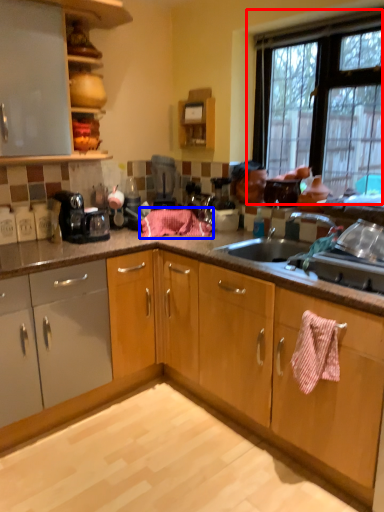
Question: Among these objects, which one is farthest to the camera, window (highlighted by a red box) or blanket (highlighted by a blue box)?

Choices:
 (A) window
 (B) blanket

Answer: (B)